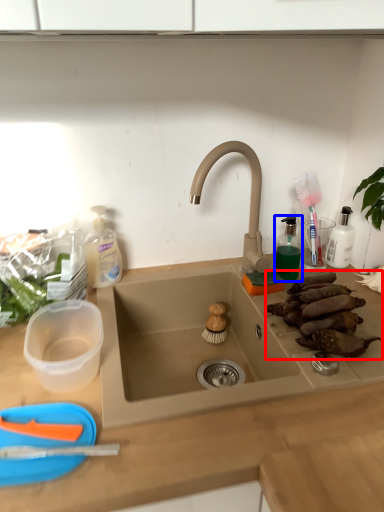
Question: Which point is further to the camera, food (highlighted by a red box) or toiletry (highlighted by a blue box)?

Choices:
 (A) food
 (B) toiletry

Answer: (B)